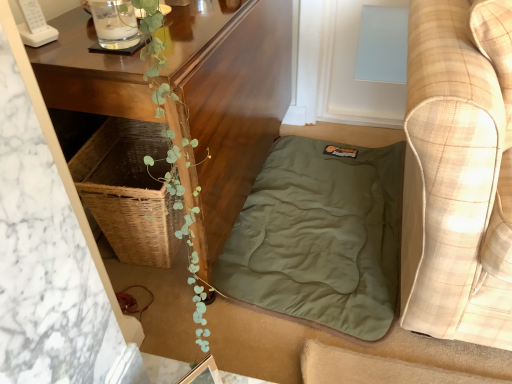
Question: Does olive green fabric at lower center have a larger size compared to plaid fabric couch at right?

Choices:
 (A) no
 (B) yes

Answer: (A)

Question: Is olive green fabric at lower center smaller than plaid fabric couch at right?

Choices:
 (A) yes
 (B) no

Answer: (A)

Question: Is olive green fabric at lower center behind plaid fabric couch at right?

Choices:
 (A) yes
 (B) no

Answer: (A)

Question: Is olive green fabric at lower center to the left of plaid fabric couch at right from the viewer's perspective?

Choices:
 (A) yes
 (B) no

Answer: (A)

Question: Is olive green fabric at lower center surrounding plaid fabric couch at right?

Choices:
 (A) no
 (B) yes

Answer: (A)

Question: Does olive green fabric at lower center lie in front of plaid fabric couch at right?

Choices:
 (A) yes
 (B) no

Answer: (B)

Question: Does wooden table at center have a greater height compared to olive green fabric at lower center?

Choices:
 (A) yes
 (B) no

Answer: (A)

Question: Is wooden table at center behind olive green fabric at lower center?

Choices:
 (A) no
 (B) yes

Answer: (A)

Question: From a real-world perspective, is wooden table at center positioned under olive green fabric at lower center based on gravity?

Choices:
 (A) yes
 (B) no

Answer: (B)

Question: Is olive green fabric at lower center surrounded by wooden table at center?

Choices:
 (A) no
 (B) yes

Answer: (A)

Question: Does wooden table at center have a greater width compared to olive green fabric at lower center?

Choices:
 (A) yes
 (B) no

Answer: (B)

Question: From the image's perspective, is wooden table at center on top of olive green fabric at lower center?

Choices:
 (A) yes
 (B) no

Answer: (A)

Question: Is plaid fabric couch at right not inside wooden table at center?

Choices:
 (A) yes
 (B) no

Answer: (A)